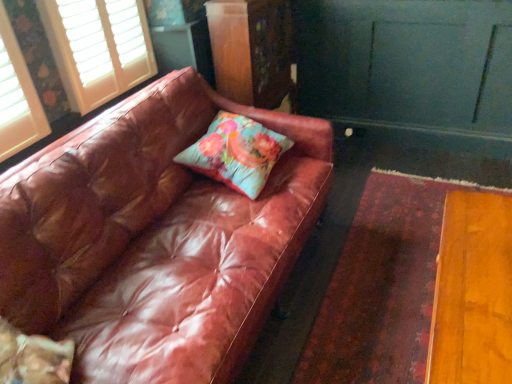
Question: Relative to wooden dresser at center, is floral fabric cushion at center in front or behind?

Choices:
 (A) behind
 (B) front

Answer: (B)

Question: Is floral fabric cushion at center inside the boundaries of wooden dresser at center, or outside?

Choices:
 (A) outside
 (B) inside

Answer: (A)

Question: Which object is the closest to the leather couch at left?

Choices:
 (A) wooden dresser at center
 (B) white wood blinds at upper left
 (C) floral fabric cushion at center

Answer: (C)

Question: Which object is positioned farthest from the leather couch at left?

Choices:
 (A) floral fabric cushion at center
 (B) wooden dresser at center
 (C) white wood blinds at upper left

Answer: (B)